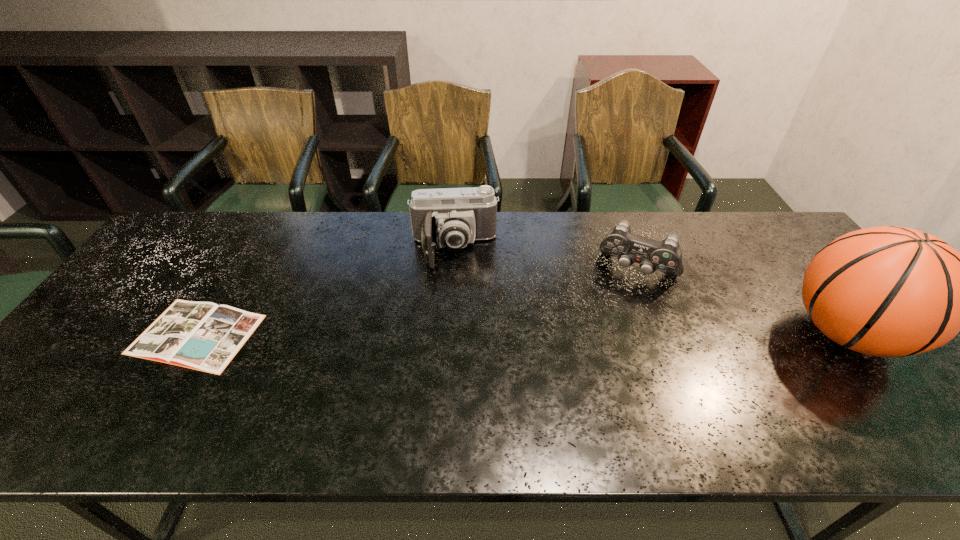
The height and width of the screenshot is (540, 960). What are the coordinates of `free space on the desktop that is between the book and the tallest object and is positioned at the front of the camera with an open lens cover` in the screenshot? It's located at (457, 334).

Locate an element on the screen. free spot on the desktop that is between the leftmost object and the basketball and is positioned on the surface of the third object from left to right with buttons is located at coordinates (610, 334).